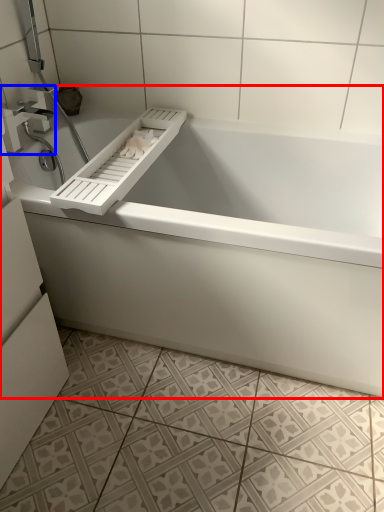
Question: Which object appears closest to the camera in this image, bathtub (highlighted by a red box) or tap (highlighted by a blue box)?

Choices:
 (A) bathtub
 (B) tap

Answer: (A)